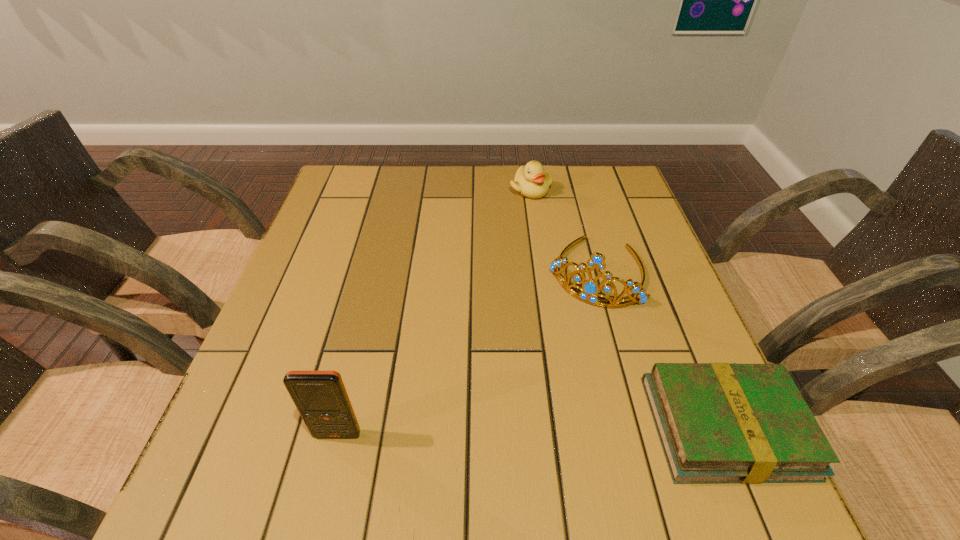
Image resolution: width=960 pixels, height=540 pixels. Find the location of `vacant space positioned on the front-facing side of the tiara`. vacant space positioned on the front-facing side of the tiara is located at coordinates (510, 443).

The height and width of the screenshot is (540, 960). I want to click on free point located on the front-facing side of the farthest object, so click(518, 278).

Find the location of a particular element. This screenshot has width=960, height=540. free space located on the front-facing side of the farthest object is located at coordinates (520, 264).

The image size is (960, 540). Find the location of `free region located 0.390m on the front-facing side of the farthest object`. free region located 0.390m on the front-facing side of the farthest object is located at coordinates (516, 299).

The image size is (960, 540). What are the coordinates of `object that is at the far edge` in the screenshot? It's located at (531, 181).

Image resolution: width=960 pixels, height=540 pixels. Identify the location of cellular telephone present at the near edge. (321, 398).

You are a GUI agent. You are given a task and a screenshot of the screen. Output one action in this format:
    pyautogui.click(x=<x>, y=<y>)
    Task: Click on the book that is at the near edge
    The image size is (960, 540).
    Given the screenshot: What is the action you would take?
    pyautogui.click(x=717, y=422)

You are a GUI agent. You are given a task and a screenshot of the screen. Output one action in this format:
    pyautogui.click(x=<x>, y=<y>)
    Task: Click on the object that is positioned at the left edge
    
    Given the screenshot: What is the action you would take?
    pyautogui.click(x=321, y=398)

This screenshot has height=540, width=960. I want to click on book positioned at the right edge, so click(x=717, y=422).

The height and width of the screenshot is (540, 960). In order to click on tiara present at the right edge in this screenshot , I will do `click(590, 289)`.